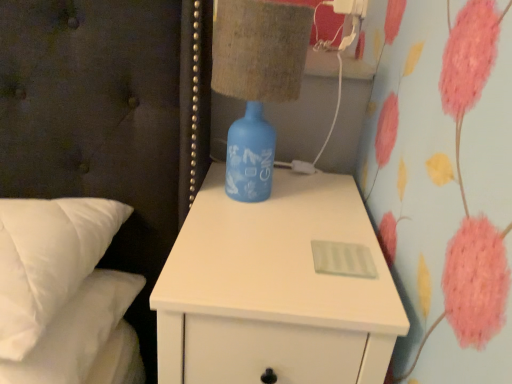
I want to click on free region under blue glass bottle at upper right (from a real-world perspective), so click(x=252, y=192).